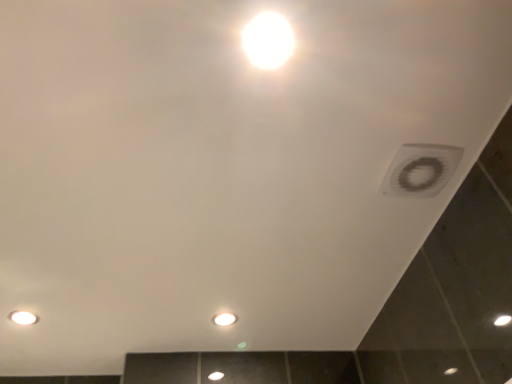
Question: Considering the relative sizes of white glossy light bulb at center, the first light bulb in the back-to-front sequence, and white matte vent at upper right in the image provided, is white glossy light bulb at center, the first light bulb in the back-to-front sequence, taller than white matte vent at upper right?

Choices:
 (A) yes
 (B) no

Answer: (B)

Question: Can you confirm if white glossy light bulb at center, which is the first light bulb from bottom to top, is bigger than white matte vent at upper right?

Choices:
 (A) no
 (B) yes

Answer: (A)

Question: Is white matte vent at upper right located within white glossy light bulb at center, which is the first light bulb from bottom to top?

Choices:
 (A) yes
 (B) no

Answer: (B)

Question: Does white glossy light bulb at center, marked as the 2th light bulb in a right-to-left arrangement, have a lesser width compared to white matte vent at upper right?

Choices:
 (A) no
 (B) yes

Answer: (B)

Question: Does white glossy light bulb at center, which ranks as the 2th light bulb in left-to-right order, appear on the right side of white matte vent at upper right?

Choices:
 (A) no
 (B) yes

Answer: (A)

Question: From the image's perspective, would you say matte white light bulb at lower left, arranged as the 2th light bulb when ordered from the bottom, is shown under white matte vent at upper right?

Choices:
 (A) yes
 (B) no

Answer: (A)

Question: From the image's perspective, is matte white light bulb at lower left, which is counted as the 2th light bulb, starting from the top, on top of white matte vent at upper right?

Choices:
 (A) yes
 (B) no

Answer: (B)

Question: From a real-world perspective, is matte white light bulb at lower left, the 2th light bulb in the front-to-back sequence, located beneath white matte vent at upper right?

Choices:
 (A) yes
 (B) no

Answer: (B)

Question: Does matte white light bulb at lower left, which is counted as the 2th light bulb, starting from the top, come in front of white matte vent at upper right?

Choices:
 (A) yes
 (B) no

Answer: (B)

Question: Is matte white light bulb at lower left, the 2th light bulb when ordered from back to front, directly adjacent to white matte vent at upper right?

Choices:
 (A) yes
 (B) no

Answer: (B)

Question: Is there a large distance between matte white light bulb at lower left, the third light bulb from the right, and white matte vent at upper right?

Choices:
 (A) no
 (B) yes

Answer: (B)

Question: Does white glossy light bulb at center, which ranks as the 2th light bulb in left-to-right order, have a smaller size compared to matte white light bulb at lower left, the 2th light bulb when ordered from back to front?

Choices:
 (A) yes
 (B) no

Answer: (B)